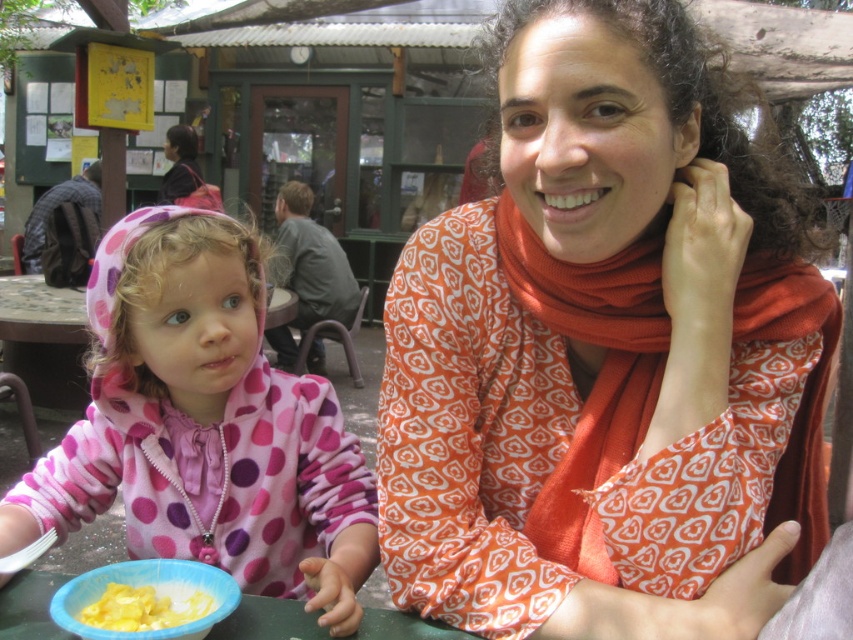
You are a photographer trying to capture the perfect shot of the scene. The pink fleece jacket at left is positioned at a specific coordinate. Can you determine if the jacket is located in the upper half of the image?

The pink fleece jacket at left is located at coordinate point (204, 426). Since the y coordinate 0.240 is less than 0.5, it is in the lower half of the image. Therefore, the jacket is not in the upper half of the image.

You are a photographer trying to capture a candid shot of both the printed orange scarf at center and the pink fleece jacket at left. Since you want both subjects in the frame, can you position yourself in a way that allows you to see both objects at the same time?

Yes, you can position yourself to the left of the pink fleece jacket at left so that the printed orange scarf at center is to your right and the pink fleece jacket at left is in front of you, ensuring both are visible in the frame.

You are a fashion designer observing this scene. You need to decide which item has a greater width for a potential collection. Which one is wider between the printed orange scarf at center and the pink fleece jacket at left?

The printed orange scarf at center might be wider than the pink fleece jacket at left according to the description.